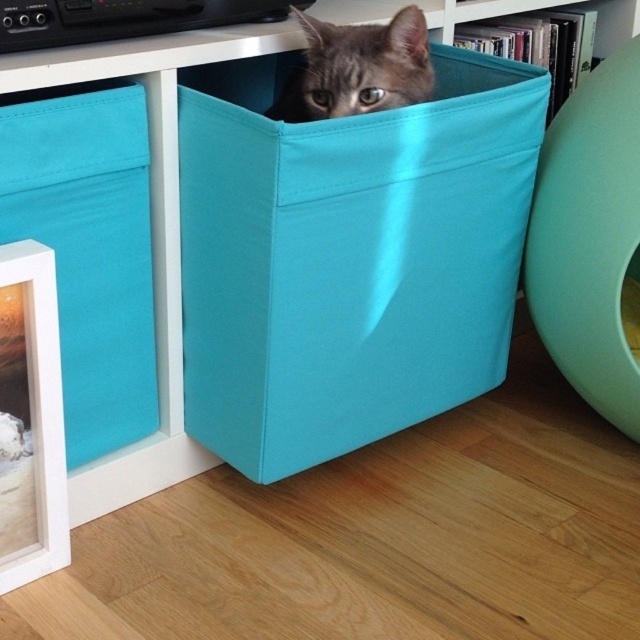
Can you confirm if teal fabric box at center is shorter than teal fabric box at left?

In fact, teal fabric box at center may be taller than teal fabric box at left.

Between point (364, 371) and point (28, 170), which one is positioned behind?

Point (364, 371)

Identify the location of teal fabric box at center. (348, 257).

Can you confirm if teal fabric box at center is smaller than gray fabric cat at upper center?

Actually, teal fabric box at center might be larger than gray fabric cat at upper center.

Does teal fabric box at center have a greater height compared to gray fabric cat at upper center?

Indeed, teal fabric box at center has a greater height compared to gray fabric cat at upper center.

Find the location of a particular element. This screenshot has height=640, width=640. teal fabric box at center is located at coordinates (348, 257).

Who is higher up, teal fabric box at left or gray fabric cat at upper center?

Positioned higher is gray fabric cat at upper center.

Between teal fabric box at left and gray fabric cat at upper center, which one appears on the left side from the viewer's perspective?

teal fabric box at left is more to the left.

Is point (108, 289) positioned in front of point (301, 81)?

Yes, point (108, 289) is in front of point (301, 81).

I want to click on teal fabric box at left, so click(90, 248).